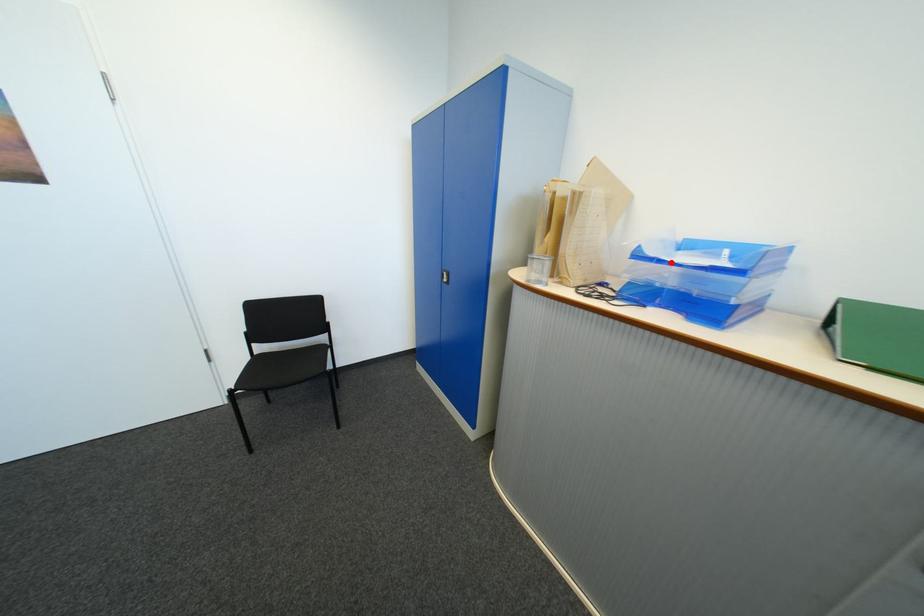
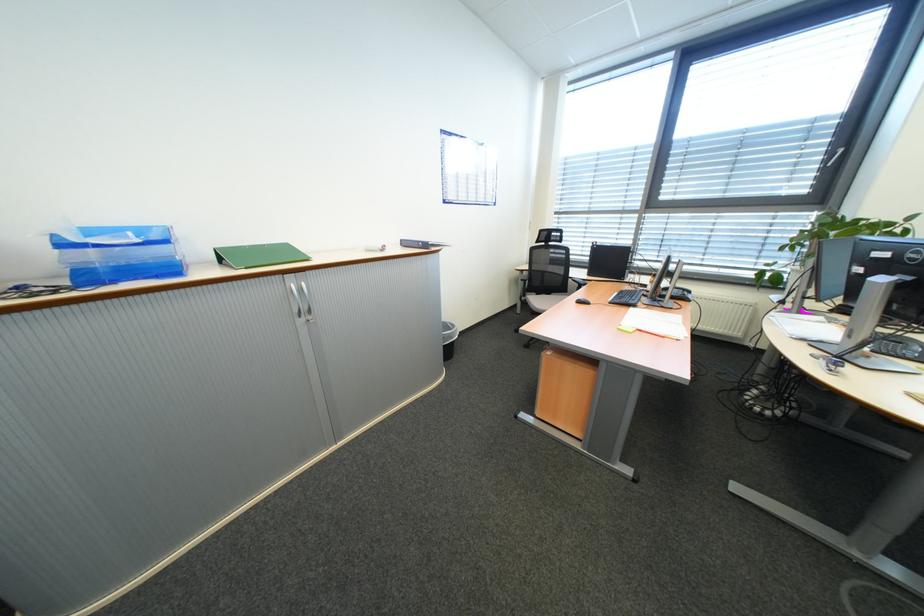
The point at the highlighted location is marked in the first image. Where is the corresponding point in the second image?

(107, 246)